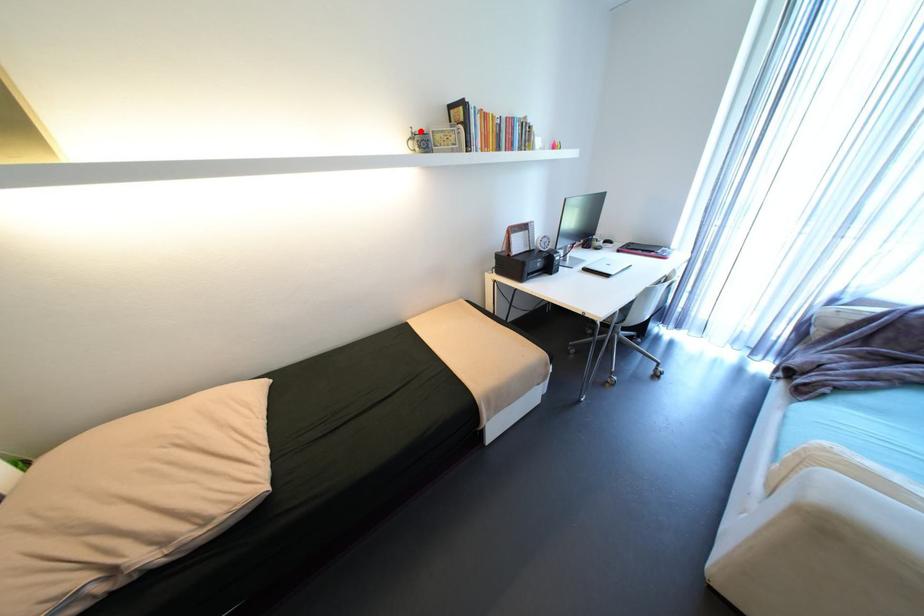
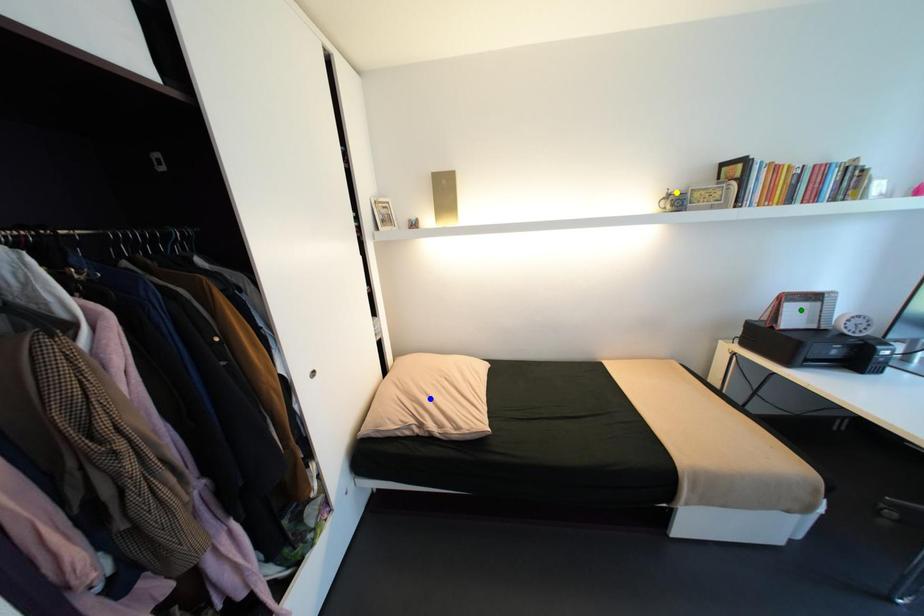
Question: I am providing you with two images of the same scene from different viewpoints. A red point is marked on the first image. You are given multiple points on the second image. Which mark in image 2 goes with the point in image 1?

Choices:
 (A) green point
 (B) blue point
 (C) yellow point

Answer: (C)